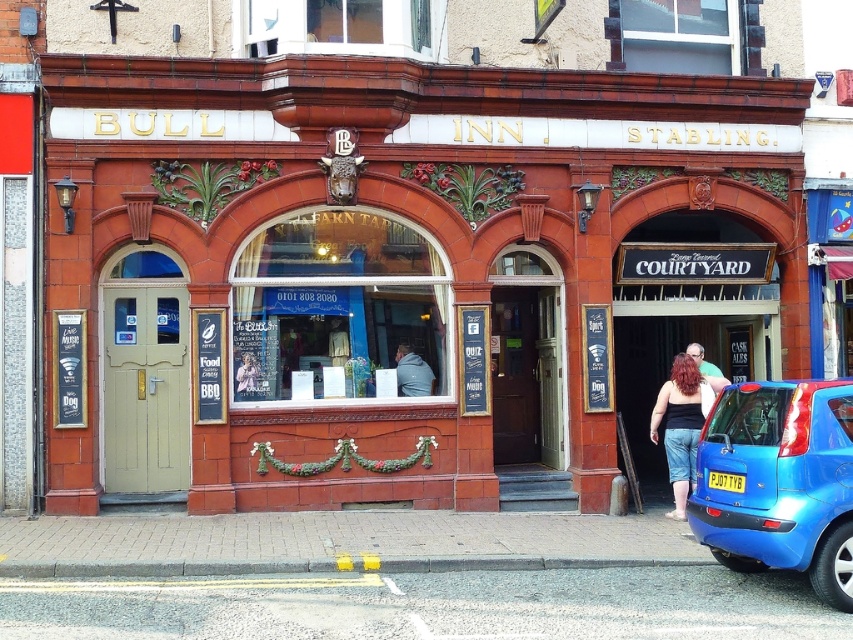
Question: Is matte black tank top at center positioned in front of matte black hair at center?

Choices:
 (A) no
 (B) yes

Answer: (B)

Question: Can you confirm if blue glossy hatchback at lower right is bigger than matte black tank top at center?

Choices:
 (A) yes
 (B) no

Answer: (A)

Question: Which point is closer to the camera?

Choices:
 (A) yellow plastic license plate at lower center
 (B) dark gray hoodie at center

Answer: (A)

Question: Which object is the closest to the red brick building at center?

Choices:
 (A) yellow plastic license plate at lower center
 (B) matte black hair at center

Answer: (B)

Question: Which of the following is the farthest from the observer?

Choices:
 (A) blue glossy hatchback at lower right
 (B) matte black hair at center
 (C) red brick building at center
 (D) matte black tank top at center

Answer: (C)

Question: Does blue glossy hatchback at lower right appear over yellow plastic license plate at lower center?

Choices:
 (A) no
 (B) yes

Answer: (A)